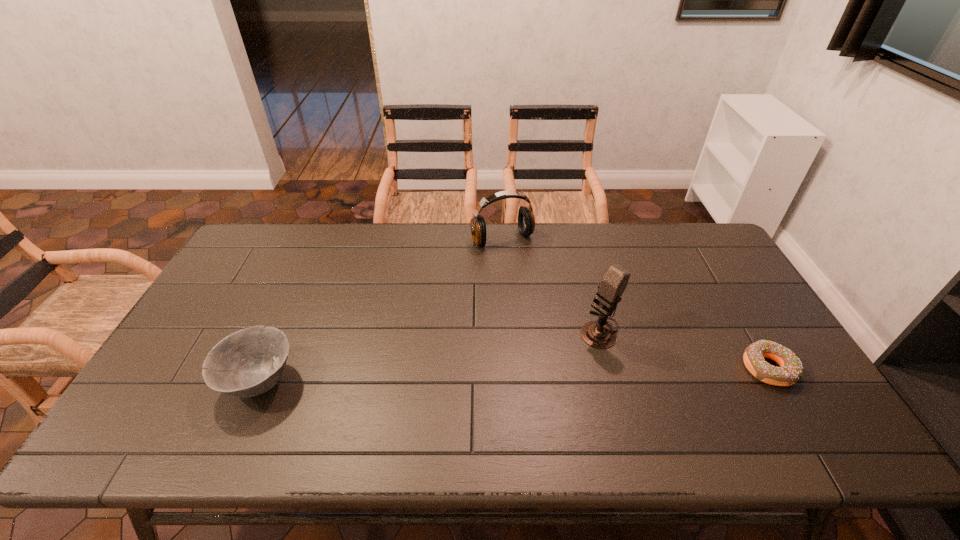
Where is `vacant spot on the desktop that is between the second shortest object and the doughnut and is positioned on the front-facing side of the microphone`? vacant spot on the desktop that is between the second shortest object and the doughnut and is positioned on the front-facing side of the microphone is located at coordinates (533, 374).

What are the coordinates of `free spot on the desktop that is between the bowl and the rightmost object and is positioned on the ear cups of the third object from right to left` in the screenshot? It's located at (588, 373).